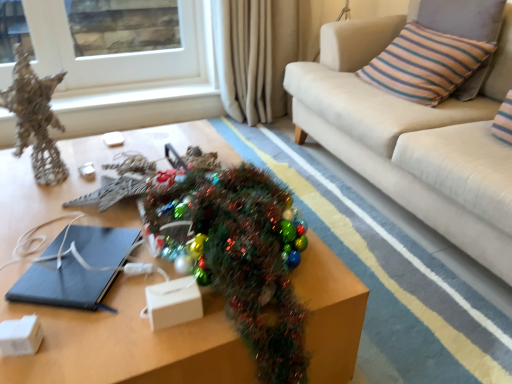
Question: Is matte black notebook at center not inside white glass window at upper left?

Choices:
 (A) yes
 (B) no

Answer: (A)

Question: From a real-world perspective, is matte black notebook at center beneath white glass window at upper left?

Choices:
 (A) no
 (B) yes

Answer: (B)

Question: Does matte black notebook at center have a lesser width compared to white glass window at upper left?

Choices:
 (A) no
 (B) yes

Answer: (A)

Question: Is the position of matte black notebook at center less distant than that of white glass window at upper left?

Choices:
 (A) yes
 (B) no

Answer: (A)

Question: Can you confirm if matte black notebook at center is positioned to the right of white glass window at upper left?

Choices:
 (A) yes
 (B) no

Answer: (A)

Question: Considering their positions, is striped fabric pillow at upper right located in front of or behind shiny metallic christmas tree at center?

Choices:
 (A) behind
 (B) front

Answer: (A)

Question: Considering the positions of striped fabric pillow at upper right and shiny metallic christmas tree at center in the image, is striped fabric pillow at upper right taller or shorter than shiny metallic christmas tree at center?

Choices:
 (A) tall
 (B) short

Answer: (B)

Question: Does point (432, 49) appear closer or farther from the camera than point (230, 190)?

Choices:
 (A) closer
 (B) farther

Answer: (B)

Question: From a real-world perspective, is striped fabric pillow at upper right above or below shiny metallic christmas tree at center?

Choices:
 (A) above
 (B) below

Answer: (A)

Question: In the image, is beige fabric couch at upper right positioned in front of or behind metallic brown table at center?

Choices:
 (A) behind
 (B) front

Answer: (A)

Question: Is beige fabric couch at upper right taller or shorter than metallic brown table at center?

Choices:
 (A) short
 (B) tall

Answer: (B)

Question: Is beige fabric couch at upper right wider or thinner than metallic brown table at center?

Choices:
 (A) thin
 (B) wide

Answer: (B)

Question: From the image's perspective, is beige fabric couch at upper right positioned above or below metallic brown table at center?

Choices:
 (A) above
 (B) below

Answer: (A)

Question: Is white glass window at upper left wider or thinner than metallic wire sculpture at left?

Choices:
 (A) thin
 (B) wide

Answer: (A)

Question: Is white glass window at upper left in front of or behind metallic wire sculpture at left in the image?

Choices:
 (A) behind
 (B) front

Answer: (A)